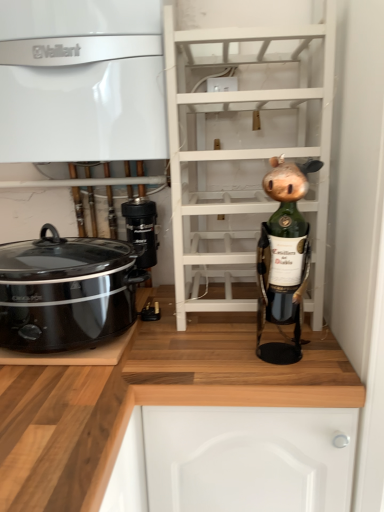
This screenshot has width=384, height=512. I want to click on vacant area to the right of black plastic slow cooker at left, so click(x=202, y=356).